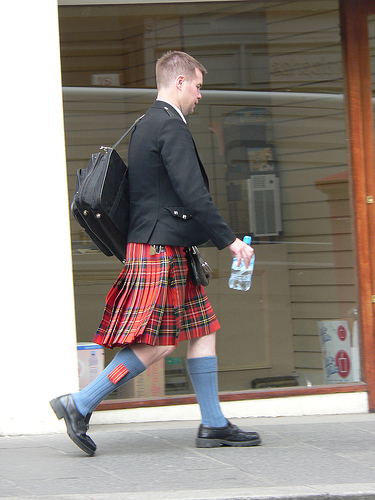
This screenshot has width=375, height=500. What are the coordinates of `sock` in the screenshot? It's located at (96, 388), (211, 397).